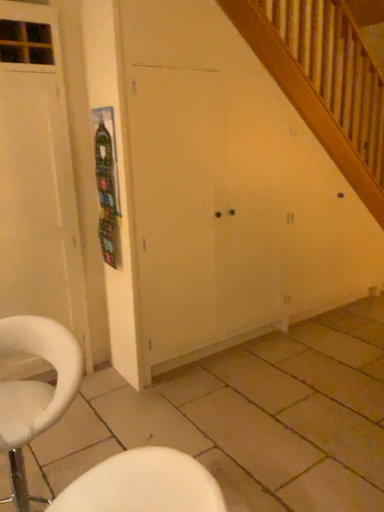
Where is `unoccupied space behind white fabric chair at lower left`? The height and width of the screenshot is (512, 384). unoccupied space behind white fabric chair at lower left is located at coordinates (69, 456).